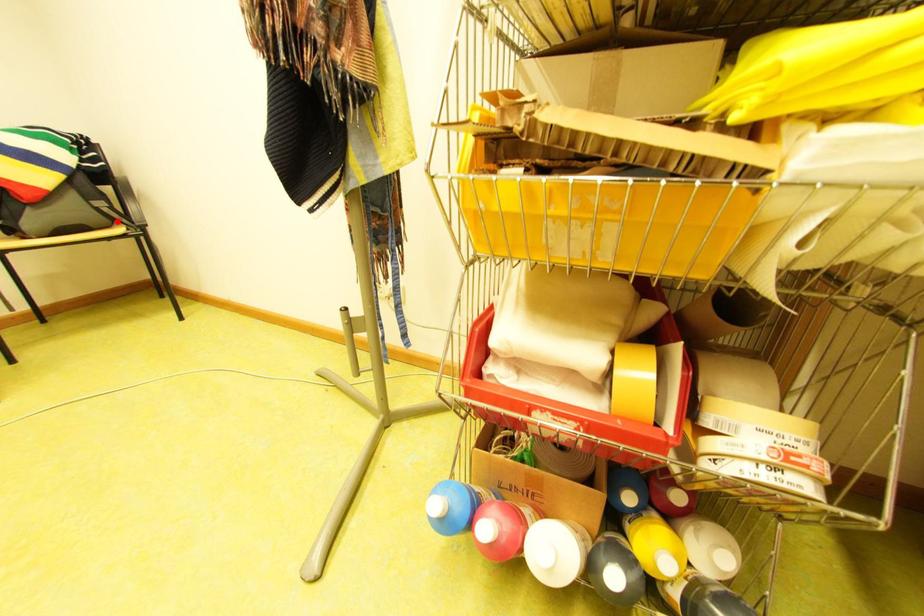
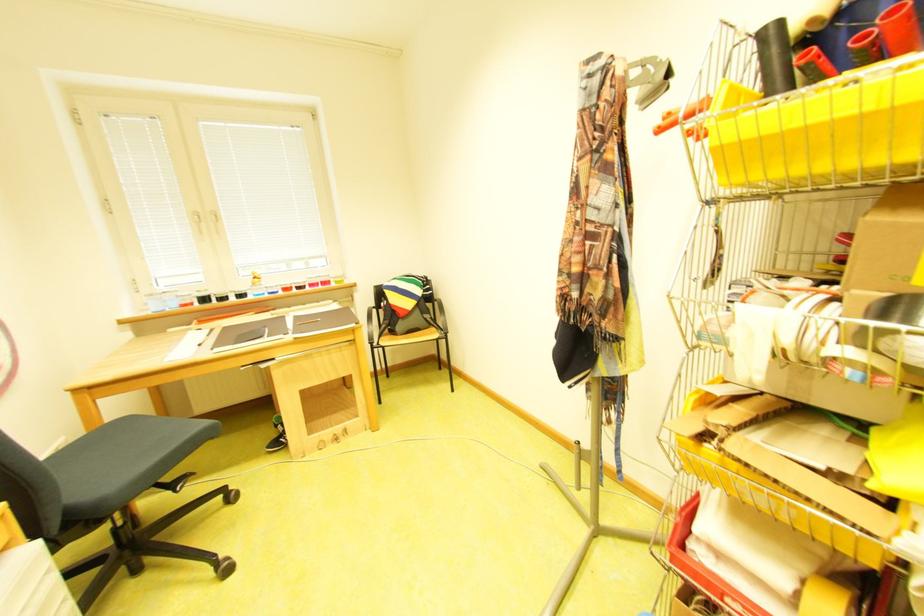
Question: I am providing you with two images of the same scene from different viewpoints. A red point is marked on the first image. At the location where the point appears in image 1, is it still visible in image 2?

Choices:
 (A) Yes
 (B) No

Answer: (A)